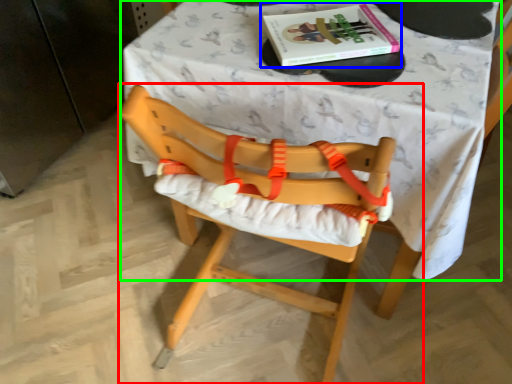
Question: Which is nearer to the chair (highlighted by a red box)? book (highlighted by a blue box) or table (highlighted by a green box).

Choices:
 (A) book
 (B) table

Answer: (B)